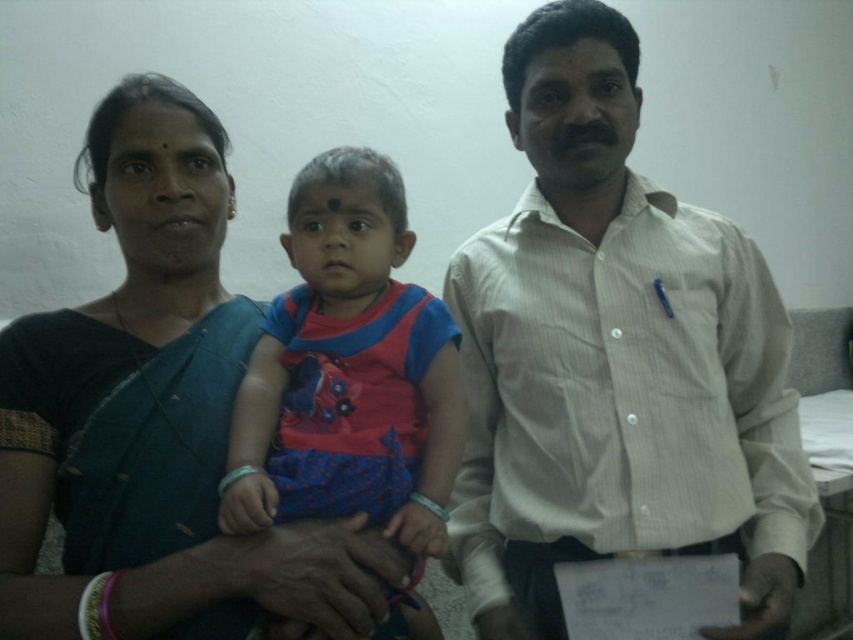
From the picture: You are standing in front of the image and want to determine the positions of two points marked in the scene. Which point, point 1 at coordinates (x=517, y=212) or point 2 at coordinates (x=27, y=435), is closer to you?

Point 1 at coordinates (x=517, y=212) is closer to you because it is further to the viewer than point 2 at coordinates (x=27, y=435).